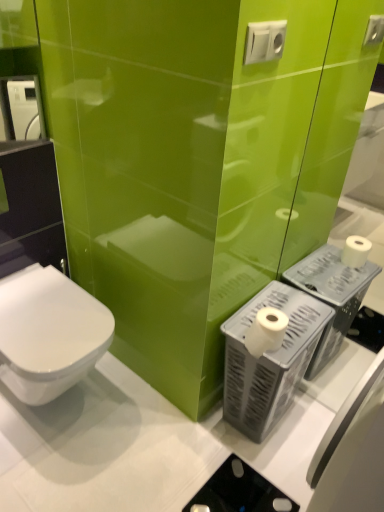
Question: Is white plastic electric outlet at upper center smaller than white plastic toilet paper holder at lower right?

Choices:
 (A) yes
 (B) no

Answer: (A)

Question: Is white plastic electric outlet at upper center far away from white plastic toilet paper holder at lower right?

Choices:
 (A) no
 (B) yes

Answer: (A)

Question: From the image's perspective, is white plastic electric outlet at upper center below white plastic toilet paper holder at lower right?

Choices:
 (A) no
 (B) yes

Answer: (A)

Question: Does white plastic electric outlet at upper center turn towards white plastic toilet paper holder at lower right?

Choices:
 (A) yes
 (B) no

Answer: (B)

Question: Can white plastic toilet paper holder at lower right be found inside white plastic electric outlet at upper center?

Choices:
 (A) yes
 (B) no

Answer: (B)

Question: Considering their positions, is white matte toilet paper at right located in front of or behind white glossy toilet at lower left?

Choices:
 (A) front
 (B) behind

Answer: (B)

Question: Looking at the image, does white matte toilet paper at right seem bigger or smaller compared to white glossy toilet at lower left?

Choices:
 (A) small
 (B) big

Answer: (A)

Question: Looking at their shapes, would you say white matte toilet paper at right is wider or thinner than white glossy toilet at lower left?

Choices:
 (A) wide
 (B) thin

Answer: (B)

Question: Considering the positions of point (274, 333) and point (6, 318), is point (274, 333) closer or farther from the camera than point (6, 318)?

Choices:
 (A) farther
 (B) closer

Answer: (B)

Question: Considering their positions, is white plastic toilet paper holder at lower right located in front of or behind white plastic electric outlet at upper center?

Choices:
 (A) front
 (B) behind

Answer: (B)

Question: Does point (304, 307) appear closer or farther from the camera than point (269, 39)?

Choices:
 (A) closer
 (B) farther

Answer: (B)

Question: From a real-world perspective, relative to white plastic electric outlet at upper center, is white plastic toilet paper holder at lower right vertically above or below?

Choices:
 (A) below
 (B) above

Answer: (A)

Question: Based on their sizes in the image, would you say white plastic toilet paper holder at lower right is bigger or smaller than white plastic electric outlet at upper center?

Choices:
 (A) big
 (B) small

Answer: (A)

Question: Would you say white glossy toilet at lower left is to the left or to the right of white matte toilet paper at right in the picture?

Choices:
 (A) right
 (B) left

Answer: (B)

Question: From a real-world perspective, is white glossy toilet at lower left positioned above or below white matte toilet paper at right?

Choices:
 (A) above
 (B) below

Answer: (B)